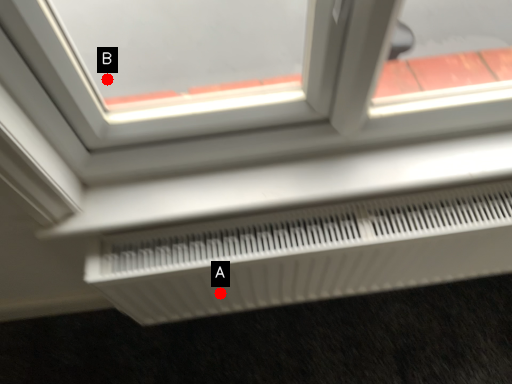
Question: Two points are circled on the image, labeled by A and B beside each circle. Which point is farther to the camera?

Choices:
 (A) A is further
 (B) B is further

Answer: (B)